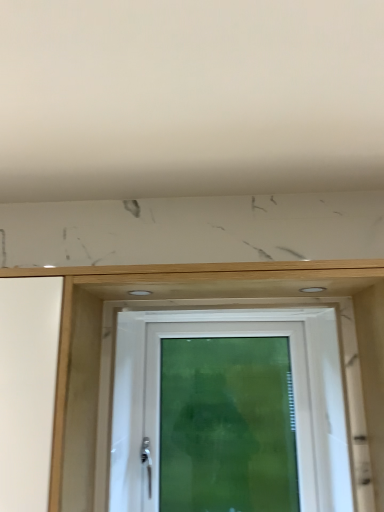
Question: Considering the relative positions of white matte hole at upper center, which ranks as the first hole in left-to-right order, and white glossy screen door at center in the image provided, is white matte hole at upper center, which ranks as the first hole in left-to-right order, to the left of white glossy screen door at center from the viewer's perspective?

Choices:
 (A) yes
 (B) no

Answer: (B)

Question: From a real-world perspective, is white matte hole at upper center, which ranks as the first hole in left-to-right order, on top of white glossy screen door at center?

Choices:
 (A) yes
 (B) no

Answer: (A)

Question: Can you confirm if white matte hole at upper center, the 2th hole in the right-to-left sequence, is smaller than white glossy screen door at center?

Choices:
 (A) yes
 (B) no

Answer: (A)

Question: Does white matte hole at upper center, the 2th hole in the right-to-left sequence, come behind white glossy screen door at center?

Choices:
 (A) yes
 (B) no

Answer: (A)

Question: Is white matte hole at upper center, the 2th hole in the right-to-left sequence, shorter than white glossy screen door at center?

Choices:
 (A) yes
 (B) no

Answer: (A)

Question: Considering the relative sizes of white matte hole at upper center, which ranks as the first hole in left-to-right order, and white glossy screen door at center in the image provided, is white matte hole at upper center, which ranks as the first hole in left-to-right order, wider than white glossy screen door at center?

Choices:
 (A) no
 (B) yes

Answer: (B)

Question: From a real-world perspective, is white matte hole at upper center, which ranks as the first hole in left-to-right order, physically above white plastic door at center?

Choices:
 (A) no
 (B) yes

Answer: (B)

Question: From a real-world perspective, is white matte hole at upper center, the 2th hole in the right-to-left sequence, located beneath white plastic door at center?

Choices:
 (A) no
 (B) yes

Answer: (A)

Question: Is white matte hole at upper center, the 2th hole in the right-to-left sequence, smaller than white plastic door at center?

Choices:
 (A) yes
 (B) no

Answer: (A)

Question: Would you say white matte hole at upper center, which ranks as the first hole in left-to-right order, is outside white plastic door at center?

Choices:
 (A) yes
 (B) no

Answer: (A)

Question: Can you confirm if white matte hole at upper center, the 2th hole in the right-to-left sequence, is positioned to the left of white plastic door at center?

Choices:
 (A) yes
 (B) no

Answer: (A)

Question: Considering the relative sizes of white matte hole at upper center, the 2th hole in the right-to-left sequence, and white plastic door at center in the image provided, is white matte hole at upper center, the 2th hole in the right-to-left sequence, bigger than white plastic door at center?

Choices:
 (A) no
 (B) yes

Answer: (A)

Question: Is white matte hole at upper center, the 2th hole in the right-to-left sequence, located within white plastic door at center?

Choices:
 (A) no
 (B) yes

Answer: (A)